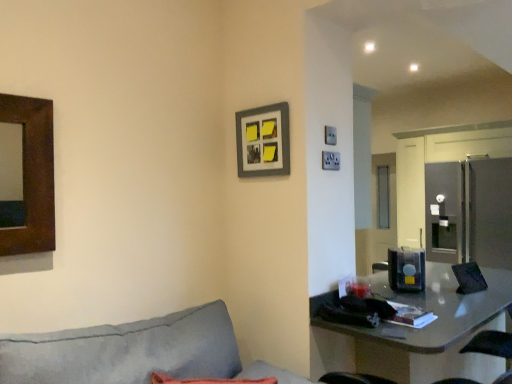
Question: Can you confirm if matte gray picture frame at upper center is positioned to the left of matte gray table at lower right?

Choices:
 (A) no
 (B) yes

Answer: (B)

Question: Is matte gray picture frame at upper center facing towards matte gray table at lower right?

Choices:
 (A) yes
 (B) no

Answer: (B)

Question: Is matte gray picture frame at upper center positioned beyond the bounds of matte gray table at lower right?

Choices:
 (A) yes
 (B) no

Answer: (A)

Question: Does matte gray picture frame at upper center have a smaller size compared to matte gray table at lower right?

Choices:
 (A) no
 (B) yes

Answer: (B)

Question: Does matte gray picture frame at upper center have a greater height compared to matte gray table at lower right?

Choices:
 (A) yes
 (B) no

Answer: (B)

Question: Are matte gray picture frame at upper center and matte gray table at lower right located far from each other?

Choices:
 (A) no
 (B) yes

Answer: (B)

Question: From a real-world perspective, is matte gray picture frame at upper center located beneath translucent plastic container at center?

Choices:
 (A) yes
 (B) no

Answer: (B)

Question: Is matte gray picture frame at upper center further to the viewer compared to translucent plastic container at center?

Choices:
 (A) no
 (B) yes

Answer: (A)

Question: Is translucent plastic container at center at the back of matte gray picture frame at upper center?

Choices:
 (A) yes
 (B) no

Answer: (B)

Question: Is matte gray picture frame at upper center positioned before translucent plastic container at center?

Choices:
 (A) yes
 (B) no

Answer: (A)

Question: Is matte gray picture frame at upper center wider than translucent plastic container at center?

Choices:
 (A) no
 (B) yes

Answer: (A)

Question: Does matte gray picture frame at upper center have a greater height compared to translucent plastic container at center?

Choices:
 (A) yes
 (B) no

Answer: (A)

Question: Is translucent plastic container at center shorter than matte gray picture frame at upper center?

Choices:
 (A) yes
 (B) no

Answer: (A)